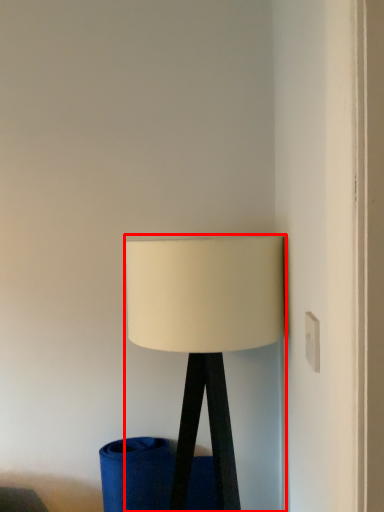
Question: From the image's perspective, considering the relative positions of lamp (annotated by the red box) and electric outlet in the image provided, where is lamp (annotated by the red box) located with respect to the staircase?

Choices:
 (A) below
 (B) above

Answer: (A)